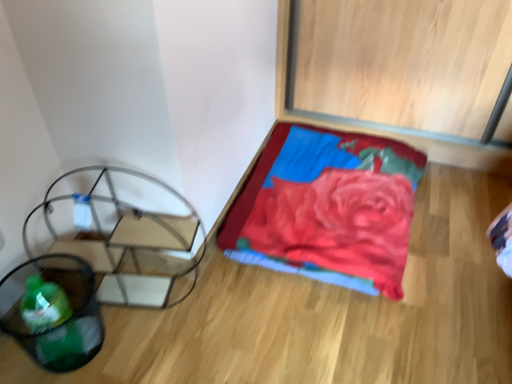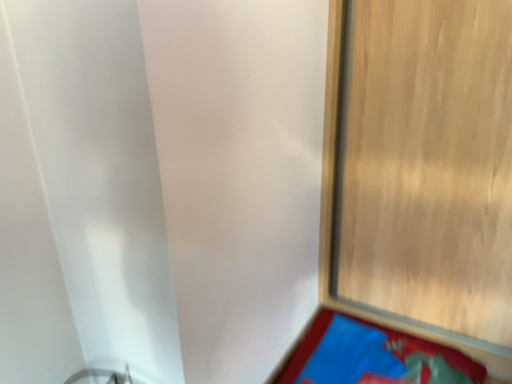
Question: Which way did the camera rotate in the video?

Choices:
 (A) rotated downward
 (B) rotated upward

Answer: (B)